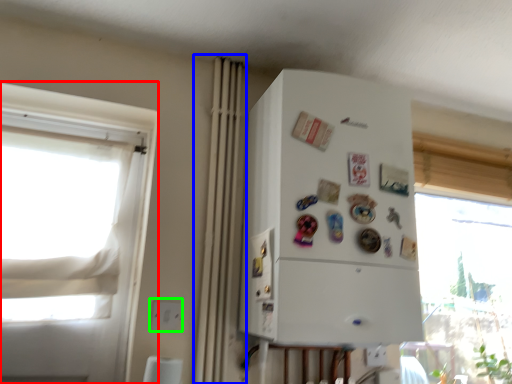
Question: Estimate the real-world distances between objects in this image. Which object is farther from window (highlighted by a red box), curtain (highlighted by a blue box) or electric outlet (highlighted by a green box)?

Choices:
 (A) curtain
 (B) electric outlet

Answer: (B)